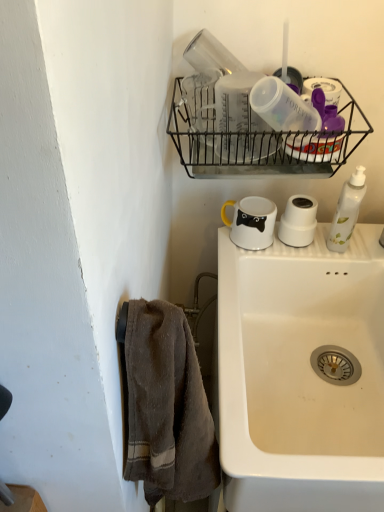
Where is `free space to the right of white glossy mug at upper center`? free space to the right of white glossy mug at upper center is located at coordinates (323, 246).